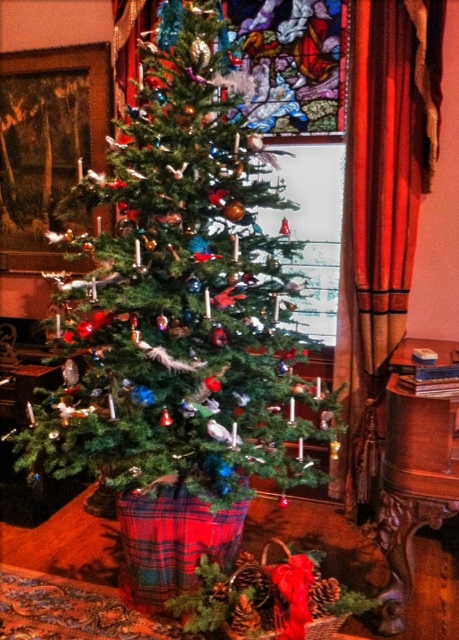
You are standing in front of the Christmas tree and want to place a gift under the closest tree. Which tree should you choose between the green matte christmas tree at center and the shiny green tree at center?

The green matte christmas tree at center is closer to the viewer, so you should place the gift under the green matte christmas tree at center.

You are standing in front of the Christmas tree and want to place a gift exactly at the base of the green matte christmas tree at center. According to the image, what are the coordinates where you should place the gift?

The coordinates for the base of the green matte christmas tree at center are at point (183, 292), so place the gift there.